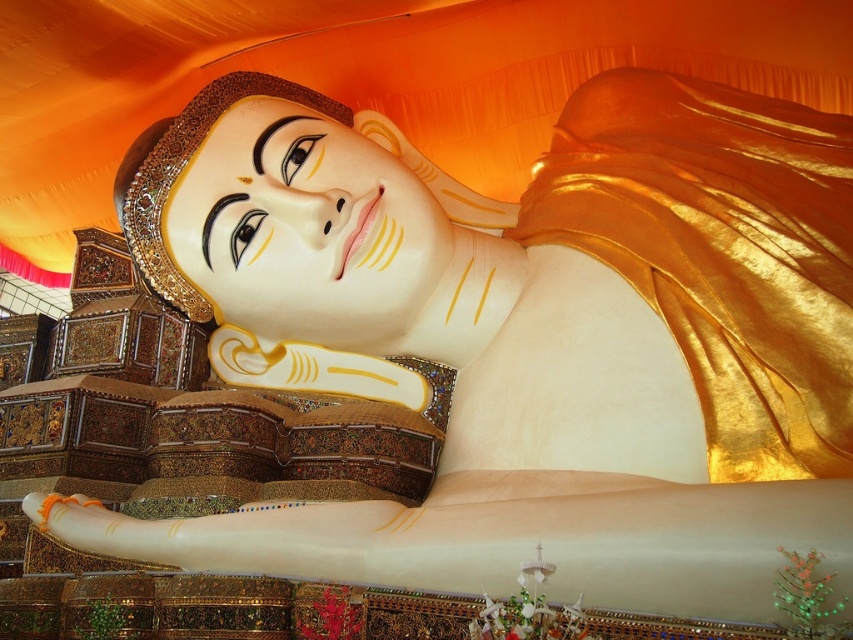
You are a photographer standing at the camera position. You want to capture a closeup shot of the gold shiny cloth at upper right. Given that your camera can focus on objects within 40 meters, will you be able to take the photo without moving closer?

The gold shiny cloth at upper right is 42.79 meters away from the camera. Since the camera can only focus on objects within 40 meters, you will not be able to take the closeup shot without moving closer.

You are an art conservator standing 100 feet away from the statue. You need to inspect both the gold shiny cloth at upper right and the matte gold face at center. Which object is closer to you?

The matte gold face at center is closer to you since it is only 76.38 feet away from the gold shiny cloth at upper right, making the matte gold face at center 76.38 feet closer than the cloth.

You are an art conservator examining the reclining Buddha statue. You notice two areas of interest on the statue. One is the gold shiny cloth at upper right and the other is the matte gold face at center. Which of these two areas is positioned lower on the statue?

The gold shiny cloth at upper right is located below the matte gold face at center, so the gold shiny cloth at upper right is positioned lower on the statue.